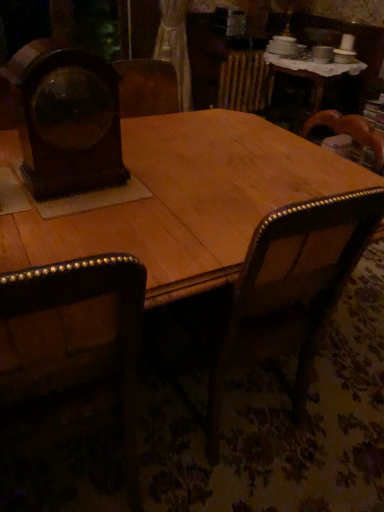
Question: Should I look upward or downward to see wooden armchair at center?

Choices:
 (A) up
 (B) down

Answer: (B)

Question: Is wooden clock at left smaller than dark brown leather chair at left?

Choices:
 (A) no
 (B) yes

Answer: (B)

Question: Is dark brown leather chair at left at the back of wooden clock at left?

Choices:
 (A) yes
 (B) no

Answer: (B)

Question: Considering the relative sizes of wooden clock at left and dark brown leather chair at left in the image provided, is wooden clock at left wider than dark brown leather chair at left?

Choices:
 (A) no
 (B) yes

Answer: (A)

Question: Is wooden clock at left to the left of dark brown leather chair at left from the viewer's perspective?

Choices:
 (A) yes
 (B) no

Answer: (B)

Question: Is dark brown leather chair at left a part of wooden clock at left?

Choices:
 (A) no
 (B) yes

Answer: (A)

Question: From the image's perspective, does wooden clock at left appear lower than dark brown leather chair at left?

Choices:
 (A) no
 (B) yes

Answer: (A)

Question: Are dark brown leather chair at left and wooden clock at left making contact?

Choices:
 (A) yes
 (B) no

Answer: (B)

Question: Is dark brown leather chair at left not near wooden clock at left?

Choices:
 (A) no
 (B) yes

Answer: (A)

Question: From the image's perspective, would you say dark brown leather chair at left is positioned over wooden clock at left?

Choices:
 (A) no
 (B) yes

Answer: (A)

Question: From a real-world perspective, is dark brown leather chair at left under wooden clock at left?

Choices:
 (A) yes
 (B) no

Answer: (A)

Question: Can you confirm if dark brown leather chair at left is thinner than wooden clock at left?

Choices:
 (A) no
 (B) yes

Answer: (A)

Question: Does dark brown leather chair at left have a greater height compared to wooden clock at left?

Choices:
 (A) yes
 (B) no

Answer: (A)

Question: Considering the relative sizes of wooden armchair at center and dark brown leather chair at left in the image provided, is wooden armchair at center taller than dark brown leather chair at left?

Choices:
 (A) no
 (B) yes

Answer: (A)